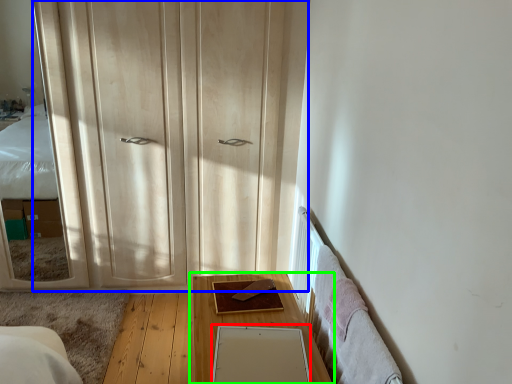
Question: Estimate the real-world distances between objects in this image. Which object is closer to mirror (highlighted by a red box), dresser (highlighted by a blue box) or table (highlighted by a green box)?

Choices:
 (A) dresser
 (B) table

Answer: (B)